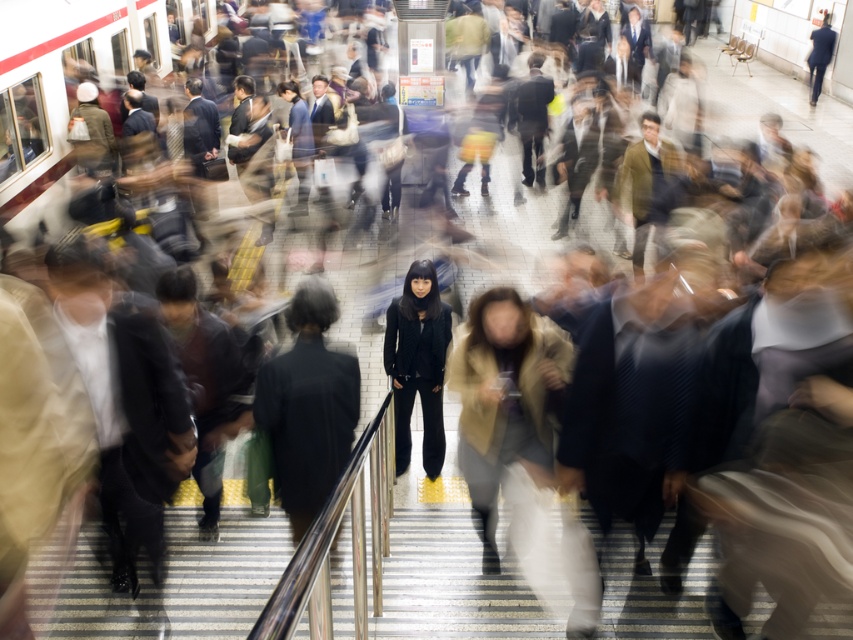
Question: Which object appears farthest from the camera in this image?

Choices:
 (A) dark gray fabric jacket at center
 (B) black matte pants at center

Answer: (B)

Question: Considering the relative positions of dark gray fabric jacket at center and black matte pants at center in the image provided, where is dark gray fabric jacket at center located with respect to black matte pants at center?

Choices:
 (A) above
 (B) below

Answer: (B)

Question: Which of the following is the closest to the observer?

Choices:
 (A) (257, 422)
 (B) (425, 275)

Answer: (A)

Question: Is dark gray fabric jacket at center smaller than black matte pants at center?

Choices:
 (A) yes
 (B) no

Answer: (A)

Question: Is dark gray fabric jacket at center to the right of black matte pants at center from the viewer's perspective?

Choices:
 (A) no
 (B) yes

Answer: (A)